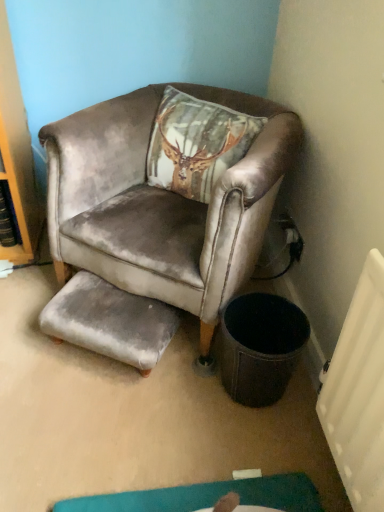
I want to click on free space above gray velvet footrest at lower center (from a real-world perspective), so click(x=107, y=298).